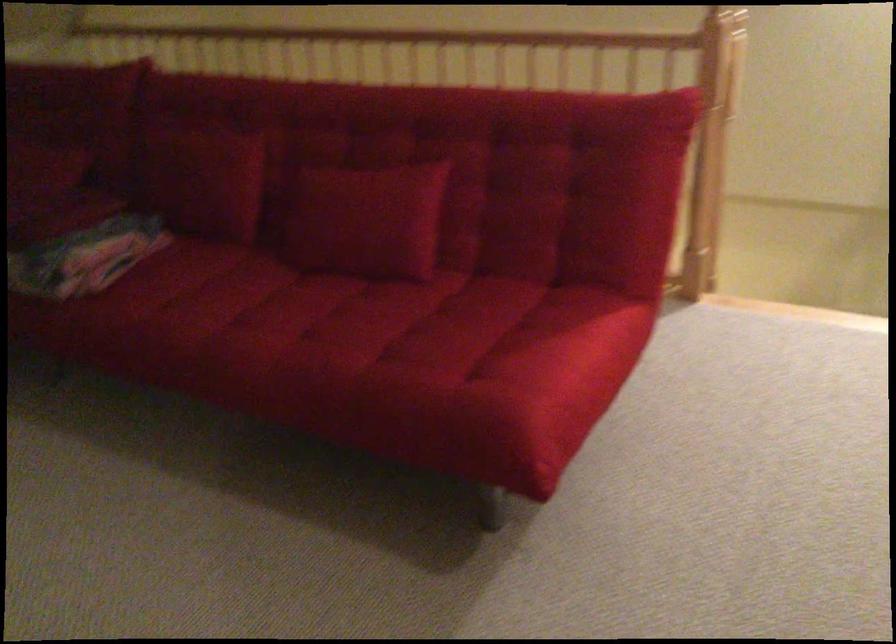
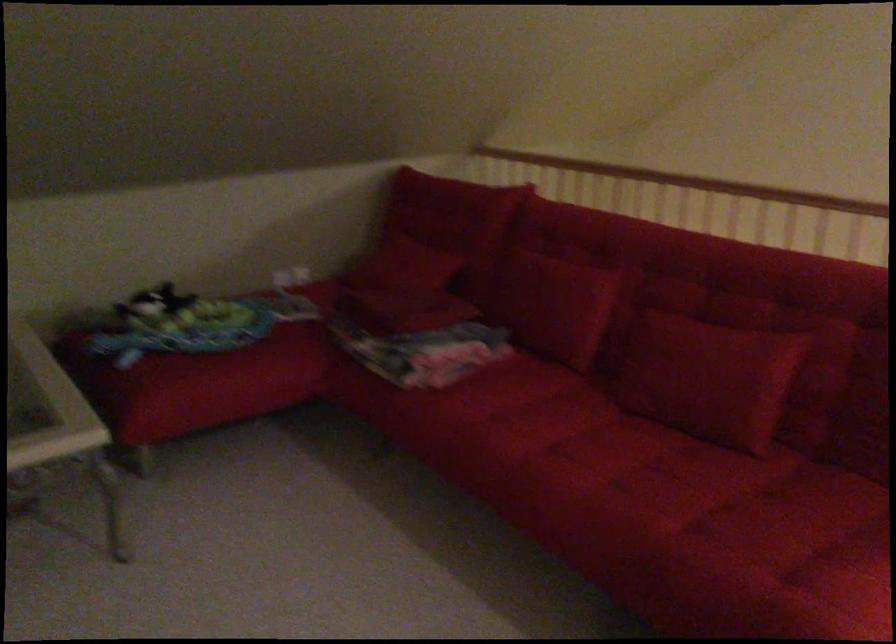
Consider the image. Which direction would the cameraman need to move to produce the second image?

The cameraman walked toward left, forward.